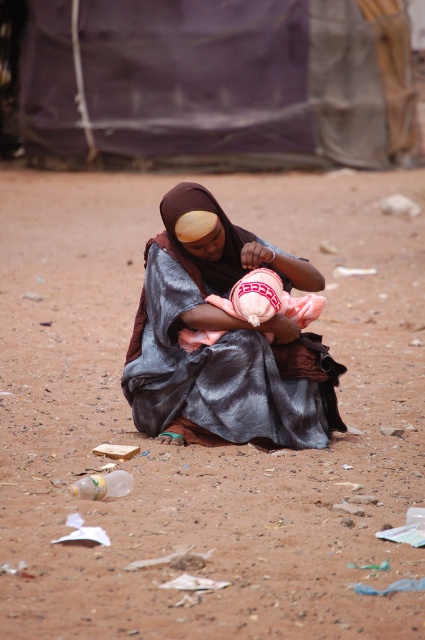
Who is more forward, (129, 182) or (269, 337)?

Point (269, 337) is in front.

Consider the image. Does brown sandy dirt at center appear under pink knitted hat at center?

Actually, brown sandy dirt at center is above pink knitted hat at center.

I want to click on brown sandy dirt at center, so click(x=197, y=444).

Can you confirm if silky brown dress at center is bigger than pink knitted hat at center?

Yes, silky brown dress at center is bigger than pink knitted hat at center.

Between point (170, 435) and point (285, 291), which one is positioned behind?

The point (285, 291) is more distant.

Locate an element on the screen. The width and height of the screenshot is (425, 640). silky brown dress at center is located at coordinates (223, 339).

Measure the distance between brown sandy dirt at center and camera.

A distance of 2.75 meters exists between brown sandy dirt at center and camera.

Does brown sandy dirt at center appear under silky brown dress at center?

No.

The height and width of the screenshot is (640, 425). Describe the element at coordinates (197, 444) in the screenshot. I see `brown sandy dirt at center` at that location.

Where is `brown sandy dirt at center`? brown sandy dirt at center is located at coordinates (197, 444).